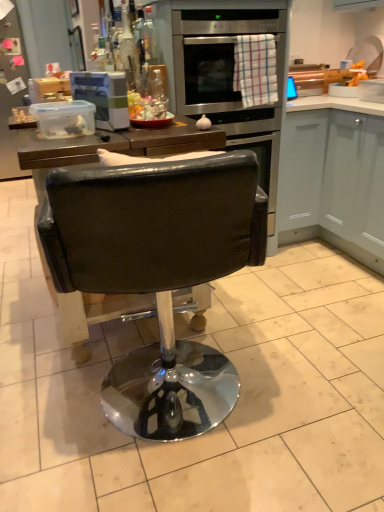
Question: Does point (344, 98) appear closer or farther from the camera than point (236, 384)?

Choices:
 (A) farther
 (B) closer

Answer: (A)

Question: Looking at their shapes, would you say white matte cabinet at right is wider or thinner than black leather chair at center?

Choices:
 (A) thin
 (B) wide

Answer: (A)

Question: Would you say white matte cabinet at right is to the left or to the right of black leather chair at center in the picture?

Choices:
 (A) right
 (B) left

Answer: (A)

Question: Does point (177, 419) appear closer or farther from the camera than point (304, 135)?

Choices:
 (A) closer
 (B) farther

Answer: (A)

Question: Looking at their shapes, would you say black leather chair at center is wider or thinner than white matte cabinet at right?

Choices:
 (A) wide
 (B) thin

Answer: (A)

Question: Would you say black leather chair at center is to the left or to the right of white matte cabinet at right in the picture?

Choices:
 (A) left
 (B) right

Answer: (A)

Question: From their relative heights in the image, would you say black leather chair at center is taller or shorter than white matte cabinet at right?

Choices:
 (A) tall
 (B) short

Answer: (A)